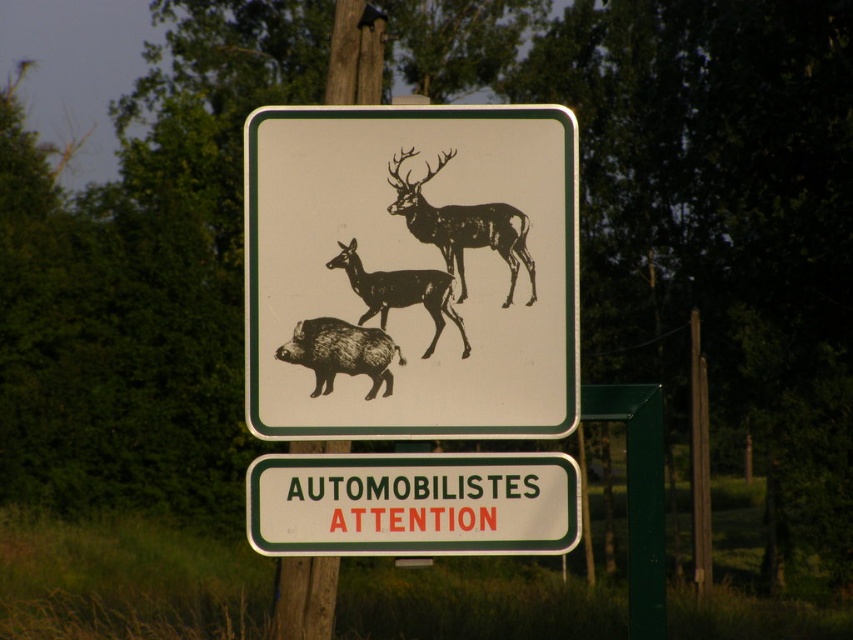
Is black paper sign at center closer to camera compared to green plastic signboard at center?

That is True.

Between point (370, 212) and point (412, 508), which one is positioned in front?

Point (370, 212) is in front.

Is point (547, 220) closer to viewer compared to point (518, 477)?

Yes.

At what (x,y) coordinates should I click in order to perform the action: click on black paper sign at center. Please return your answer as a coordinate pair (x, y). Looking at the image, I should click on (415, 268).

Image resolution: width=853 pixels, height=640 pixels. What do you see at coordinates (461, 225) in the screenshot?
I see `black matte/deer at upper center` at bounding box center [461, 225].

Which is behind, point (442, 257) or point (328, 342)?

Positioned behind is point (442, 257).

Locate an element on the screen. black matte/deer at upper center is located at coordinates (461, 225).

Can you confirm if green plastic signboard at center is taller than black matte/deer at upper center?

No.

What are the coordinates of `green plastic signboard at center` in the screenshot? It's located at (412, 504).